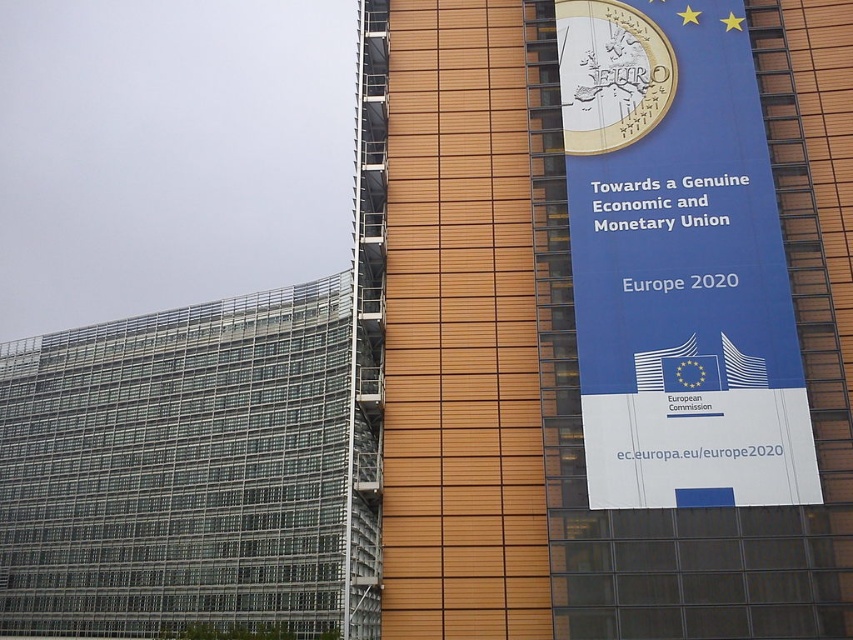
Can you confirm if blue fabric banner at upper center is positioned above blue paper banner at upper right?

No.

From the picture: Who is higher up, blue fabric banner at upper center or blue paper banner at upper right?

Positioned higher is blue paper banner at upper right.

Is point (422, 483) in front of point (698, 221)?

Yes, point (422, 483) is in front of point (698, 221).

The image size is (853, 640). In order to click on blue fabric banner at upper center in this screenshot , I will do `click(608, 316)`.